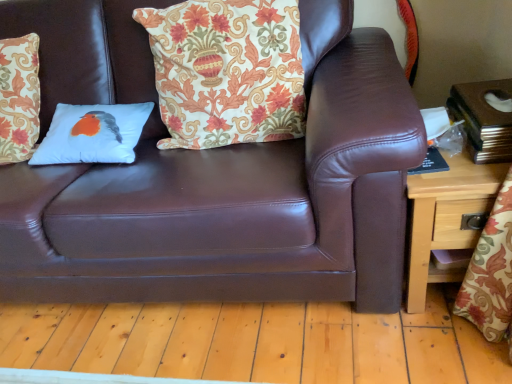
Question: Does white fabric pillow with bird design at center, the second pillow in the left-to-right sequence, have a lesser width compared to brown leather couch at center?

Choices:
 (A) no
 (B) yes

Answer: (B)

Question: Does white fabric pillow with bird design at center, the second pillow in the left-to-right sequence, have a smaller size compared to brown leather couch at center?

Choices:
 (A) yes
 (B) no

Answer: (A)

Question: Is white fabric pillow with bird design at center, the second pillow in the left-to-right sequence, bigger than brown leather couch at center?

Choices:
 (A) yes
 (B) no

Answer: (B)

Question: Is white fabric pillow with bird design at center, the second pillow in the left-to-right sequence, positioned before brown leather couch at center?

Choices:
 (A) yes
 (B) no

Answer: (B)

Question: Is white fabric pillow with bird design at center, which is the 1th pillow in right-to-left order, positioned behind brown leather couch at center?

Choices:
 (A) no
 (B) yes

Answer: (B)

Question: Does white fabric pillow with bird design at center, which is the 1th pillow in right-to-left order, appear on the left side of brown leather couch at center?

Choices:
 (A) no
 (B) yes

Answer: (A)

Question: From a real-world perspective, is brown leather couch at center located higher than white matte pillow with bird design at center, which ranks as the 2th pillow in right-to-left order?

Choices:
 (A) no
 (B) yes

Answer: (A)

Question: From a real-world perspective, is brown leather couch at center located beneath white matte pillow with bird design at center, which ranks as the 2th pillow in right-to-left order?

Choices:
 (A) no
 (B) yes

Answer: (B)

Question: Is brown leather couch at center at the left side of white matte pillow with bird design at center, which ranks as the first pillow in left-to-right order?

Choices:
 (A) no
 (B) yes

Answer: (A)

Question: Is white matte pillow with bird design at center, which ranks as the 2th pillow in right-to-left order, located within brown leather couch at center?

Choices:
 (A) no
 (B) yes

Answer: (B)

Question: Is brown leather couch at center wider than white matte pillow with bird design at center, which ranks as the first pillow in left-to-right order?

Choices:
 (A) yes
 (B) no

Answer: (A)

Question: Is brown leather couch at center not near white matte pillow with bird design at center, which ranks as the 2th pillow in right-to-left order?

Choices:
 (A) no
 (B) yes

Answer: (A)

Question: Could you tell me if white matte pillow with bird design at center, which ranks as the first pillow in left-to-right order, is turned towards wooden side table at right?

Choices:
 (A) no
 (B) yes

Answer: (A)